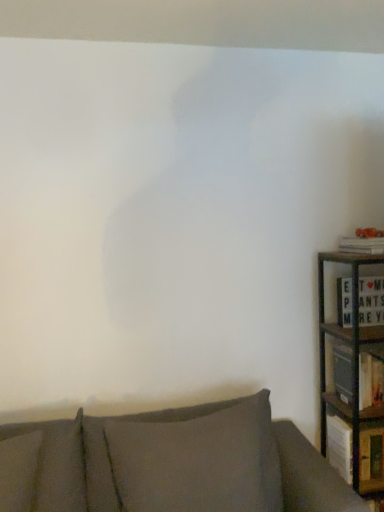
Question: Can we say dark gray fabric pillow at lower center lies outside white matte letter board at right, the 2th book from the top?

Choices:
 (A) yes
 (B) no

Answer: (A)

Question: Is dark gray fabric pillow at lower center far from white matte letter board at right, the 2th book from the top?

Choices:
 (A) no
 (B) yes

Answer: (A)

Question: Would you say dark gray fabric pillow at lower center contains white matte letter board at right, placed as the second book when sorted from bottom to top?

Choices:
 (A) no
 (B) yes

Answer: (A)

Question: Could you tell me if dark gray fabric pillow at lower center is facing white matte letter board at right, the 2th book from the top?

Choices:
 (A) yes
 (B) no

Answer: (B)

Question: Is dark gray fabric pillow at lower center positioned with its back to white matte letter board at right, placed as the second book when sorted from bottom to top?

Choices:
 (A) no
 (B) yes

Answer: (A)

Question: From the image's perspective, is textured gray couch at lower center positioned above or below white matte letter board at right, the 2th book from the top?

Choices:
 (A) below
 (B) above

Answer: (A)

Question: Considering the positions of textured gray couch at lower center and white matte letter board at right, placed as the second book when sorted from bottom to top, in the image, is textured gray couch at lower center bigger or smaller than white matte letter board at right, placed as the second book when sorted from bottom to top,?

Choices:
 (A) big
 (B) small

Answer: (A)

Question: Considering the positions of point (205, 466) and point (367, 282), is point (205, 466) closer or farther from the camera than point (367, 282)?

Choices:
 (A) farther
 (B) closer

Answer: (B)

Question: Is textured gray couch at lower center wider or thinner than white matte letter board at right, the 2th book from the top?

Choices:
 (A) wide
 (B) thin

Answer: (A)

Question: Is metallic green bookcase at right inside the boundaries of wooden bookshelf at right, or outside?

Choices:
 (A) inside
 (B) outside

Answer: (B)

Question: In the image, is metallic green bookcase at right positioned in front of or behind wooden bookshelf at right?

Choices:
 (A) behind
 (B) front

Answer: (B)

Question: Looking at their shapes, would you say metallic green bookcase at right is wider or thinner than wooden bookshelf at right?

Choices:
 (A) wide
 (B) thin

Answer: (A)

Question: In terms of height, does metallic green bookcase at right look taller or shorter compared to wooden bookshelf at right?

Choices:
 (A) tall
 (B) short

Answer: (A)

Question: Is wooden bookshelf at right bigger or smaller than orange textured book at right, the third book from the bottom?

Choices:
 (A) big
 (B) small

Answer: (A)

Question: From a real-world perspective, is wooden bookshelf at right above or below orange textured book at right, which is the 1th book from top to bottom?

Choices:
 (A) below
 (B) above

Answer: (A)